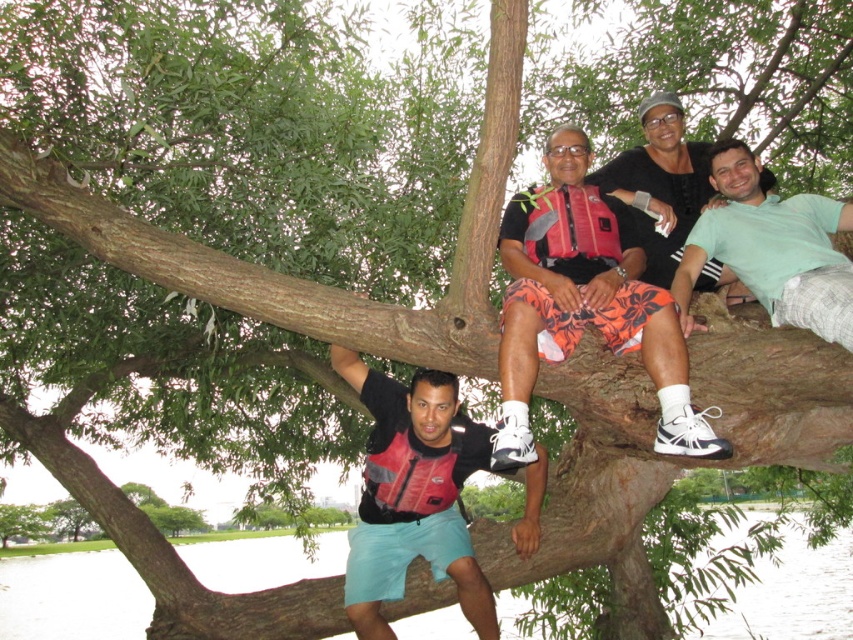
Image resolution: width=853 pixels, height=640 pixels. What do you see at coordinates (73, 596) in the screenshot?
I see `smooth water at lower left` at bounding box center [73, 596].

This screenshot has height=640, width=853. I want to click on smooth water at lower left, so click(73, 596).

Is floral shorts at center to the left of matte red life vest at center from the viewer's perspective?

No, floral shorts at center is not to the left of matte red life vest at center.

Which is below, floral shorts at center or matte red life vest at center?

matte red life vest at center

Who is more distant from viewer, (619, 243) or (480, 604)?

The point (480, 604) is more distant.

Identify the location of floral shorts at center. (585, 304).

Can you confirm if floral shorts at center is wider than smooth water at lower left?

Incorrect, floral shorts at center's width does not surpass smooth water at lower left's.

Is floral shorts at center positioned at the back of smooth water at lower left?

No.

Find the location of a particular element. floral shorts at center is located at coordinates (585, 304).